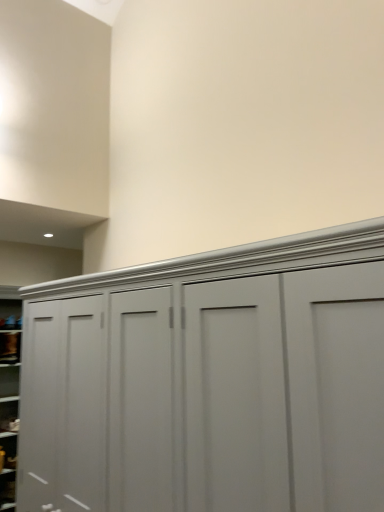
Question: From a real-world perspective, is matte gray cupboard at center located beneath matte gray cabinet at lower left, the first cabinet when ordered from top to bottom?

Choices:
 (A) yes
 (B) no

Answer: (A)

Question: From a real-world perspective, is matte gray cupboard at center positioned over matte gray cabinet at lower left, the first cabinet when ordered from top to bottom, based on gravity?

Choices:
 (A) no
 (B) yes

Answer: (A)

Question: From the image's perspective, is matte gray cupboard at center over matte gray cabinet at lower left, placed as the 2th cabinet when sorted from bottom to top?

Choices:
 (A) yes
 (B) no

Answer: (A)

Question: Considering the relative sizes of matte gray cupboard at center and matte gray cabinet at lower left, placed as the 2th cabinet when sorted from bottom to top, in the image provided, is matte gray cupboard at center smaller than matte gray cabinet at lower left, placed as the 2th cabinet when sorted from bottom to top,?

Choices:
 (A) no
 (B) yes

Answer: (A)

Question: Considering the relative sizes of matte gray cupboard at center and matte gray cabinet at lower left, the first cabinet when ordered from top to bottom, in the image provided, is matte gray cupboard at center shorter than matte gray cabinet at lower left, the first cabinet when ordered from top to bottom,?

Choices:
 (A) yes
 (B) no

Answer: (B)

Question: Based on their sizes in the image, would you say matte gray cupboard at center is bigger or smaller than matte gray cabinet at lower left, the second cabinet when ordered from top to bottom?

Choices:
 (A) small
 (B) big

Answer: (B)

Question: Is matte gray cupboard at center in front of or behind matte gray cabinet at lower left, the second cabinet when ordered from top to bottom, in the image?

Choices:
 (A) front
 (B) behind

Answer: (A)

Question: From their relative heights in the image, would you say matte gray cupboard at center is taller or shorter than matte gray cabinet at lower left, the second cabinet when ordered from top to bottom?

Choices:
 (A) short
 (B) tall

Answer: (B)

Question: Does point (82, 477) appear closer or farther from the camera than point (6, 483)?

Choices:
 (A) closer
 (B) farther

Answer: (A)

Question: Looking at their shapes, would you say matte gray cabinet at lower left, which ranks as the 1th cabinet in bottom-to-top order, is wider or thinner than matte gray cabinet at lower left, placed as the 2th cabinet when sorted from bottom to top?

Choices:
 (A) thin
 (B) wide

Answer: (B)

Question: Considering their positions, is matte gray cabinet at lower left, the second cabinet when ordered from top to bottom, located in front of or behind matte gray cabinet at lower left, placed as the 2th cabinet when sorted from bottom to top?

Choices:
 (A) behind
 (B) front

Answer: (B)

Question: Would you say matte gray cabinet at lower left, the second cabinet when ordered from top to bottom, is to the left or to the right of matte gray cabinet at lower left, placed as the 2th cabinet when sorted from bottom to top, in the picture?

Choices:
 (A) right
 (B) left

Answer: (A)

Question: From a real-world perspective, is matte gray cabinet at lower left, the second cabinet when ordered from top to bottom, above or below matte gray cabinet at lower left, placed as the 2th cabinet when sorted from bottom to top?

Choices:
 (A) above
 (B) below

Answer: (B)

Question: Choose the correct answer: Is matte gray cabinet at lower left, the second cabinet when ordered from top to bottom, inside matte gray cupboard at center or outside it?

Choices:
 (A) inside
 (B) outside

Answer: (B)

Question: From their relative heights in the image, would you say matte gray cabinet at lower left, the second cabinet when ordered from top to bottom, is taller or shorter than matte gray cupboard at center?

Choices:
 (A) short
 (B) tall

Answer: (A)